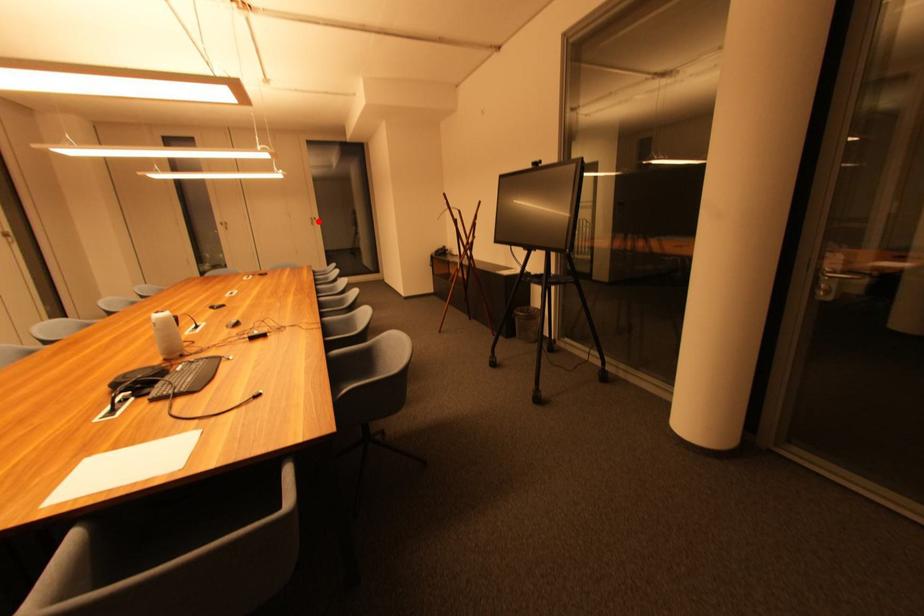
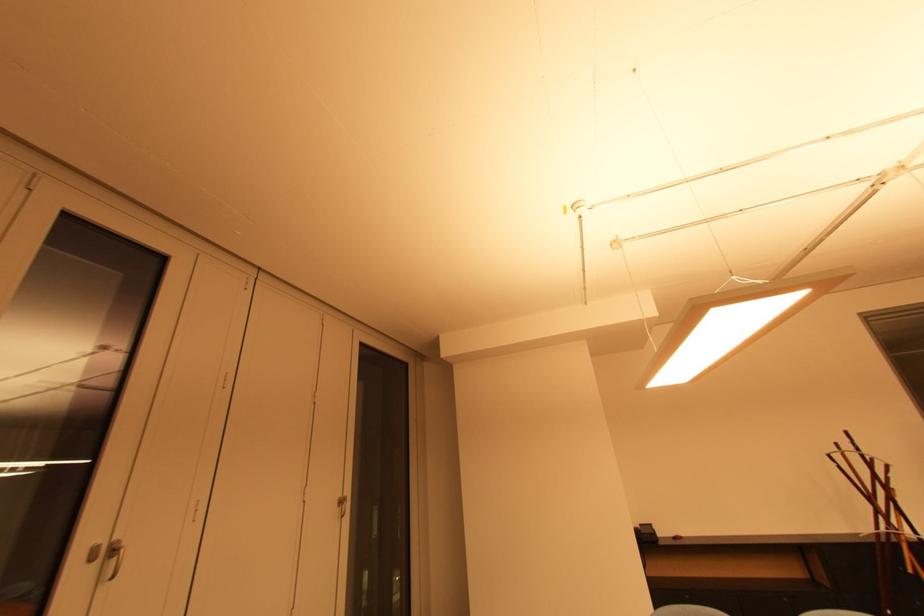
Question: A red point is marked in image1. In image2, is the corresponding 3D point closer to the camera or farther? Reply with the corresponding letter.

Choices:
 (A) The corresponding 3D point is closer.
 (B) The corresponding 3D point is farther.

Answer: (B)